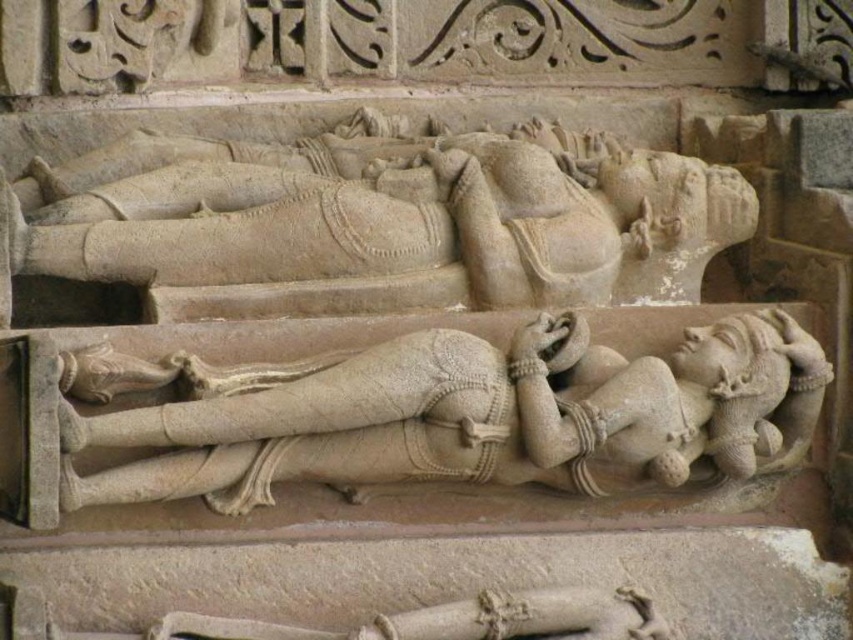
You are an archaeologist standing at the origin point of a coordinate system placed at the bottom left corner of this ancient temple wall. You need to locate the stone statue at center. What are its coordinates?

The coordinates of the stone statue at center are at point (379,220).

You are an art conservator examining two statues in a temple. The stone statue at center and the smooth beige statue at center are positioned in front of you. Which statue would require more space to transport due to its size?

The stone statue at center requires more space to transport because it has a larger size compared to the smooth beige statue at center.

You are an archaeologist examining the stone sculptures. You notice two points marked on the sculptures. Which point is closer to you, point (x=346, y=285) or point (x=450, y=465)?

Point (x=346, y=285) is further to the viewer than point (x=450, y=465). Therefore, point (x=450, y=465) is closer to you.